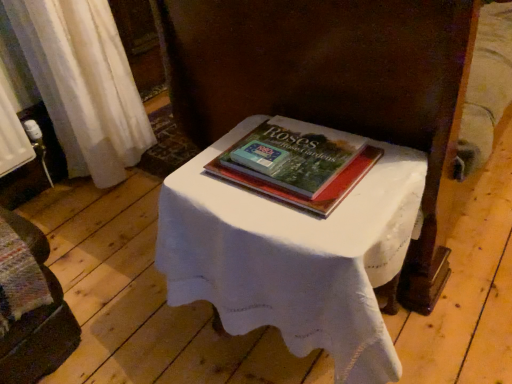
Image resolution: width=512 pixels, height=384 pixels. In order to click on free space to the right of wooden bench at lower left in this screenshot , I will do tap(124, 308).